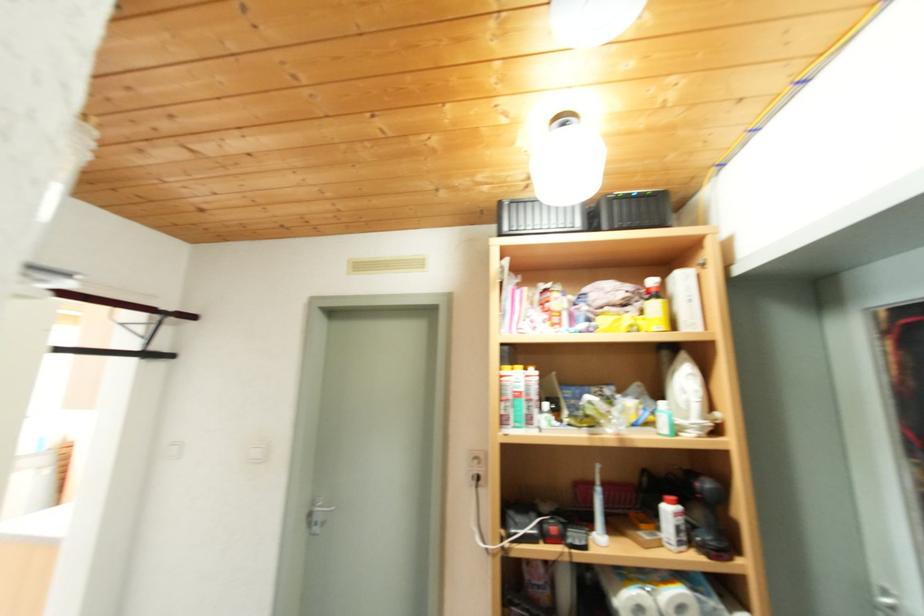
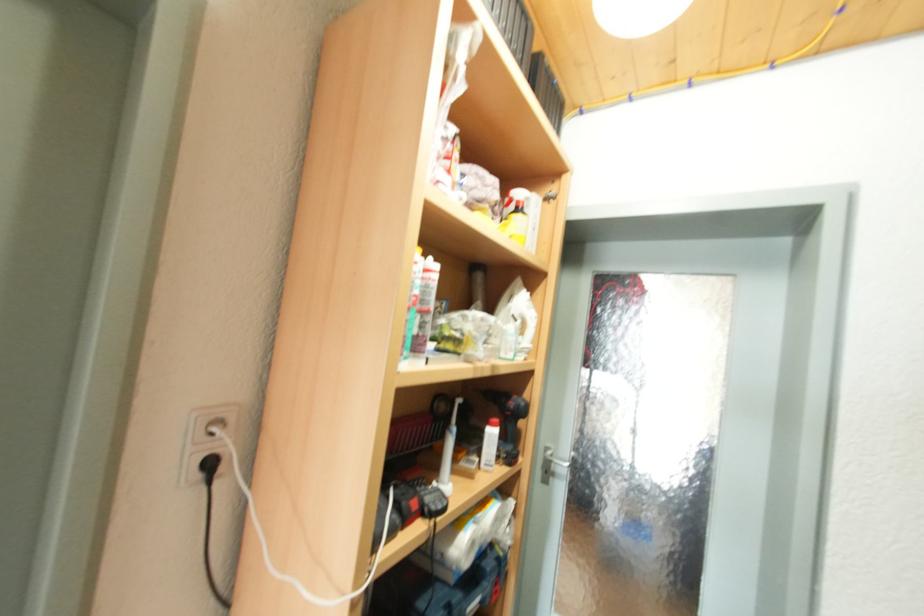
Question: The camera is either moving clockwise (left) or counter-clockwise (right) around the object. The first image is from the beginning of the video and the second image is from the end. Is the camera moving left or right when shooting the video?

Choices:
 (A) Left
 (B) Right

Answer: (A)